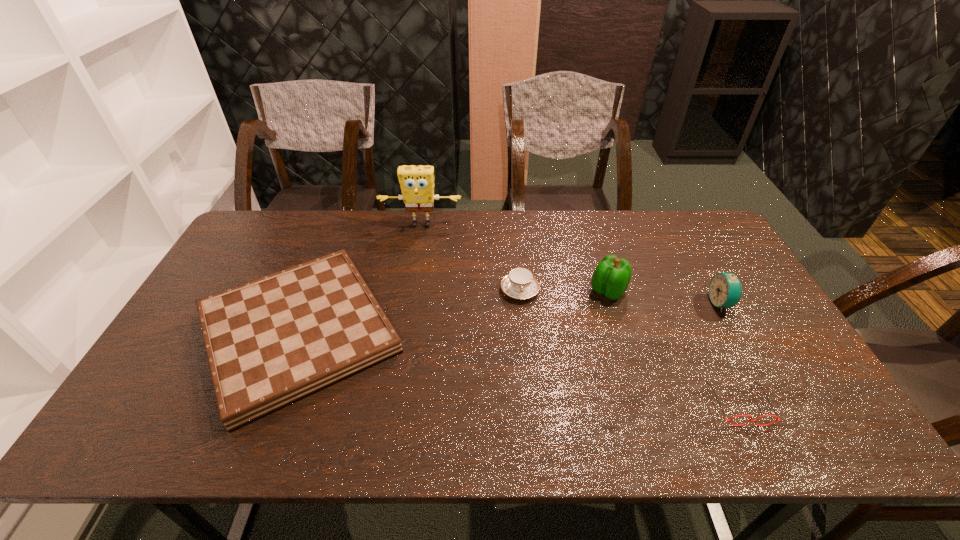
This screenshot has width=960, height=540. Identify the location of sponge. (417, 182).

Find the location of a particular element. the farthest object is located at coordinates (417, 182).

Locate an element on the screen. the third object from right to left is located at coordinates (611, 277).

At what (x,y) coordinates should I click in order to perform the action: click on alarm clock. Please return your answer as a coordinate pair (x, y). The height and width of the screenshot is (540, 960). Looking at the image, I should click on (725, 290).

The image size is (960, 540). Find the location of `the fourth object from right to left`. the fourth object from right to left is located at coordinates (520, 284).

Identify the location of gameboard. The width and height of the screenshot is (960, 540). (273, 341).

What are the coordinates of `spectacles` in the screenshot? It's located at (755, 421).

Locate an element on the screen. vacant space situated 0.290m on the face of the farthest object is located at coordinates (410, 291).

Image resolution: width=960 pixels, height=540 pixels. What are the coordinates of `free space located 0.310m on the front of the third object from right to left` in the screenshot? It's located at (640, 398).

Where is `free space located on the front-facing side of the alarm clock`? This screenshot has height=540, width=960. free space located on the front-facing side of the alarm clock is located at coordinates (573, 303).